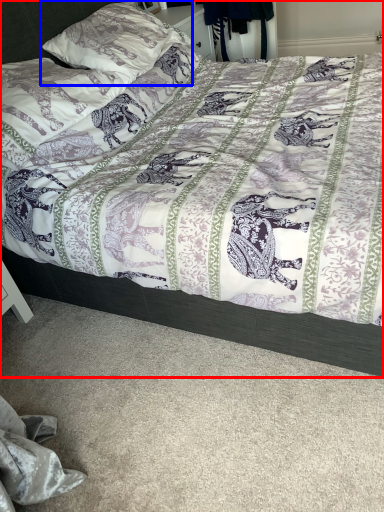
Question: Which of the following is the farthest to the observer, bed (highlighted by a red box) or pillow (highlighted by a blue box)?

Choices:
 (A) bed
 (B) pillow

Answer: (B)